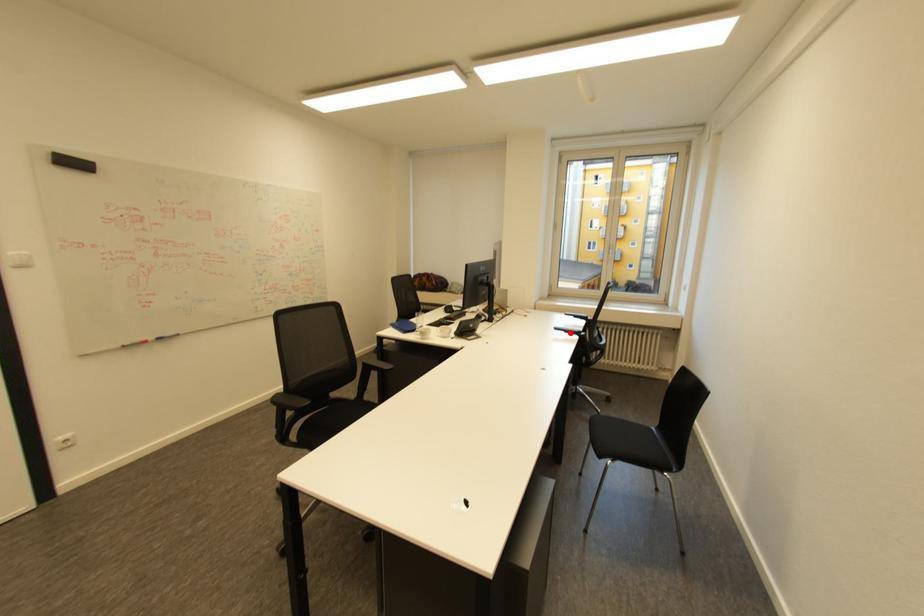
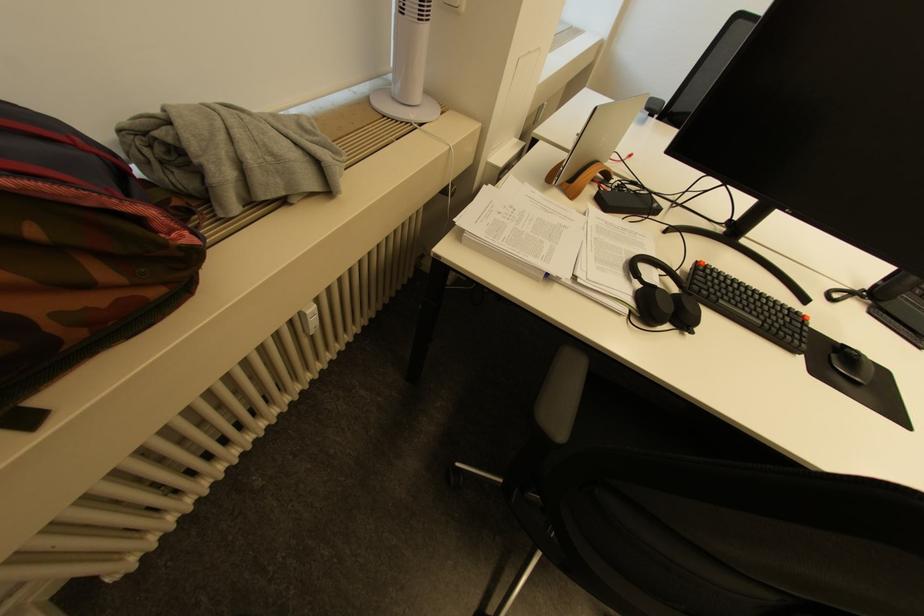
Question: I am providing you with two images of the same scene from different viewpoints. A red point is marked on the first image. Can you still see the location of the red point in image 2?

Choices:
 (A) Yes
 (B) No

Answer: (B)